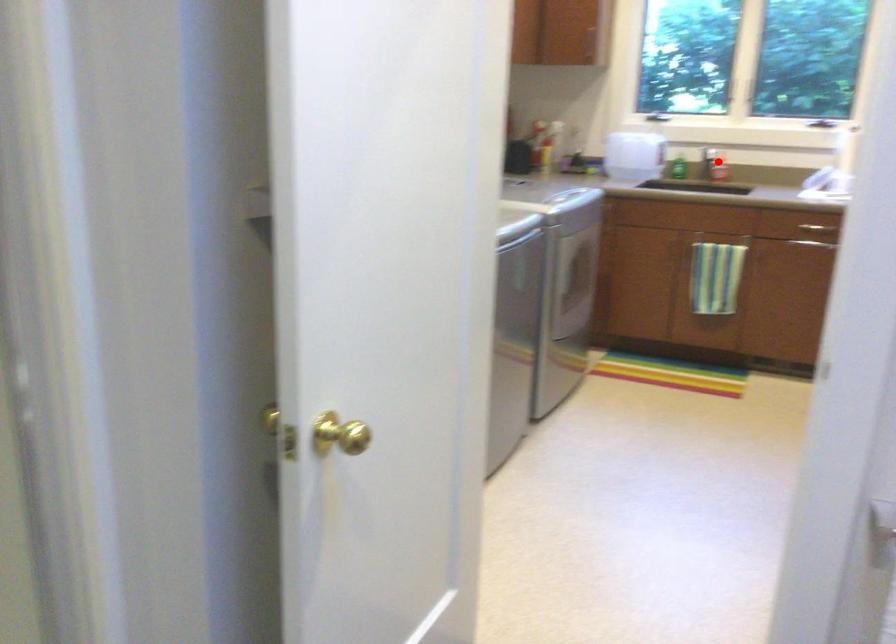
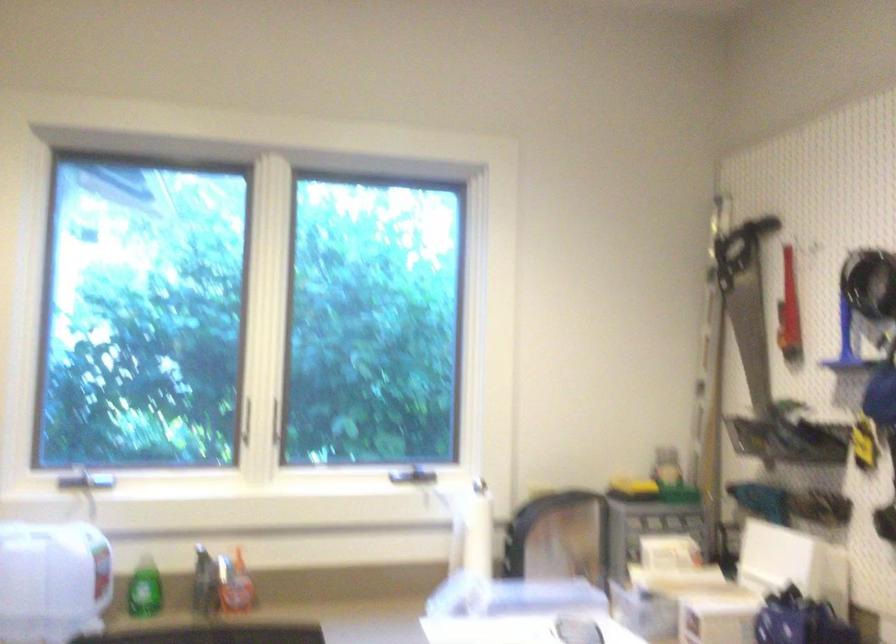
Question: A red point is marked in image1. In image2, is the corresponding 3D point closer to the camera or farther? Reply with the corresponding letter.

Choices:
 (A) The corresponding 3D point is closer.
 (B) The corresponding 3D point is farther.

Answer: (A)